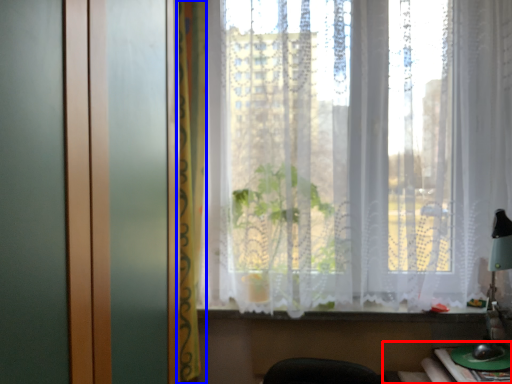
Question: Which object is closer to the camera taking this photo, table (highlighted by a red box) or curtain (highlighted by a blue box)?

Choices:
 (A) table
 (B) curtain

Answer: (A)